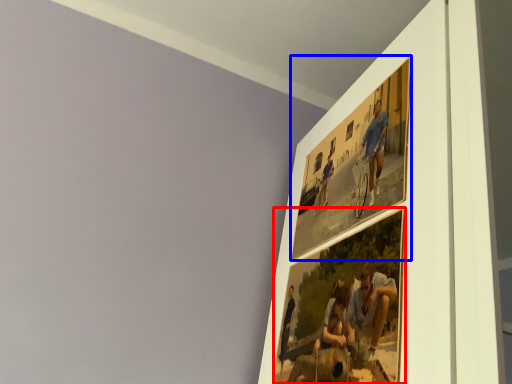
Question: Which point is closer to the camera, picture frame (highlighted by a red box) or picture frame (highlighted by a blue box)?

Choices:
 (A) picture frame
 (B) picture frame

Answer: (A)